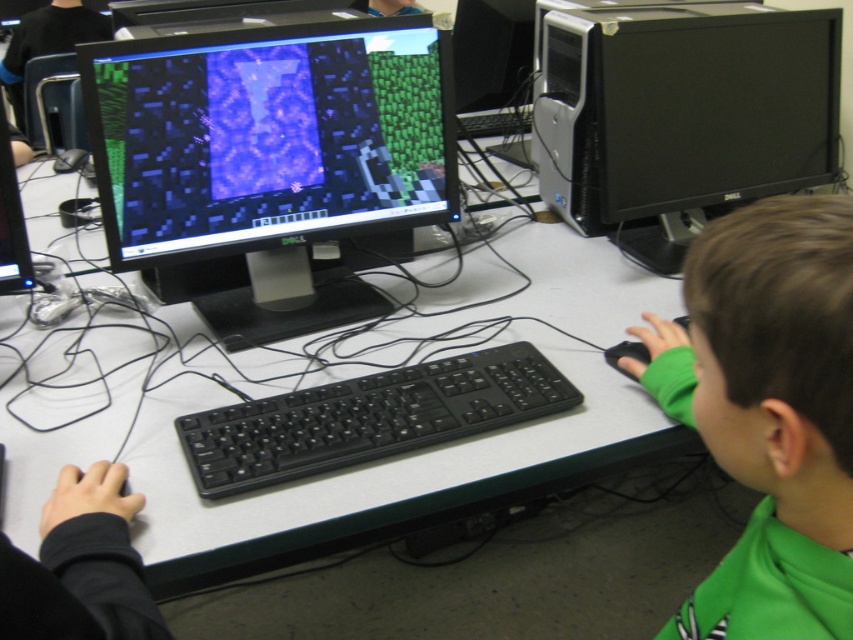
Question: Does black glossy monitor at center have a greater width compared to green fleece at lower right?

Choices:
 (A) yes
 (B) no

Answer: (A)

Question: Does green fleece at lower right have a larger size compared to black plastic keyboard at center?

Choices:
 (A) yes
 (B) no

Answer: (B)

Question: Which point appears farthest from the camera in this image?

Choices:
 (A) (x=241, y=465)
 (B) (x=335, y=125)

Answer: (B)

Question: Which point is farther from the camera taking this photo?

Choices:
 (A) tap(549, 371)
 (B) tap(705, 433)
 (C) tap(39, 204)
 (D) tap(575, 173)

Answer: (C)

Question: Does white plastic table at center come in front of black plastic keyboard at center?

Choices:
 (A) no
 (B) yes

Answer: (B)

Question: Which point is farther from the camera taking this photo?

Choices:
 (A) (196, 115)
 (B) (227, 470)
 (C) (129, 316)

Answer: (C)